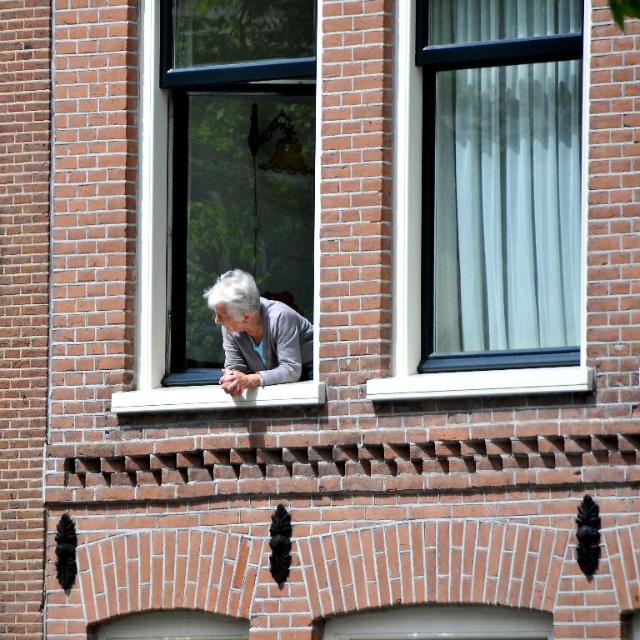
Between point (410, 147) and point (259, 362), which one is positioned in front?

Point (410, 147) is more forward.

Who is more forward, (x=406, y=108) or (x=221, y=280)?

Positioned in front is point (x=406, y=108).

You are a GUI agent. You are given a task and a screenshot of the screen. Output one action in this format:
    pyautogui.click(x=<x>, y=<y>)
    Task: Click on the white sheer curtain at upper right
    
    Given the screenshot: What is the action you would take?
    pyautogui.click(x=419, y=250)

Is point (234, 317) less distant than point (128, 401)?

Yes, point (234, 317) is closer to viewer.

Identify the location of gray matte sweater at center. Image resolution: width=640 pixels, height=640 pixels. (257, 336).

Which of these two, clear glass window at center or gray matte sweater at center, stands shorter?

Standing shorter between the two is gray matte sweater at center.

Between clear glass window at center and gray matte sweater at center, which one appears on the right side from the viewer's perspective?

gray matte sweater at center is more to the right.

Is point (259, 24) behind point (269, 301)?

Yes, point (259, 24) is behind point (269, 301).

Image resolution: width=640 pixels, height=640 pixels. I want to click on clear glass window at center, so click(x=227, y=198).